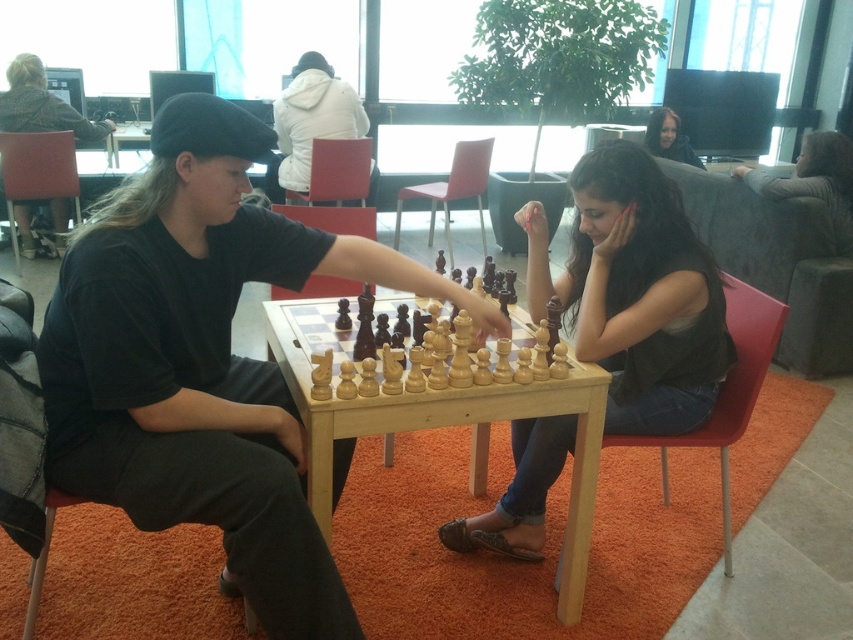
You are a photographer positioned in front of the chessboard. You want to take a photo focusing on the wooden chess pieces at center while also capturing the white matte jacket at upper center in the background. Can you position yourself so that both are in focus?

The wooden chess pieces at center are closer to the viewer than the white matte jacket at upper center. Since both objects are at different distances, achieving focus on both might be challenging depending on the camera settings. However, with a narrow aperture for greater depth of field, it could be possible to have both in focus.

What are the coordinates of the wooden chess pieces at center?

The wooden chess pieces at center are located at coordinates point (635, 291).

Looking at this image, you are observing a chess game between two people sitting on red chairs. You notice the white matte jacket at upper center and the matte black hair at upper center. Which object is positioned closer to you?

The white matte jacket at upper center is closer to the viewer than the matte black hair at upper center.